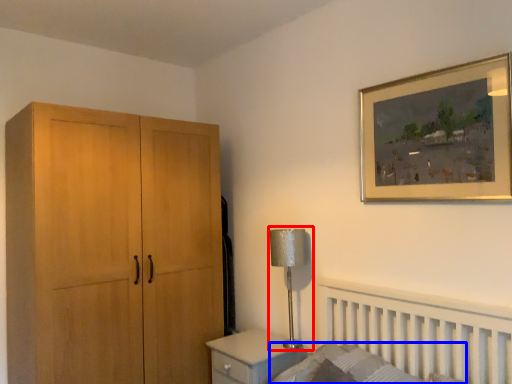
Question: Which point is further to the camera, table lamp (highlighted by a red box) or mattress (highlighted by a blue box)?

Choices:
 (A) table lamp
 (B) mattress

Answer: (A)